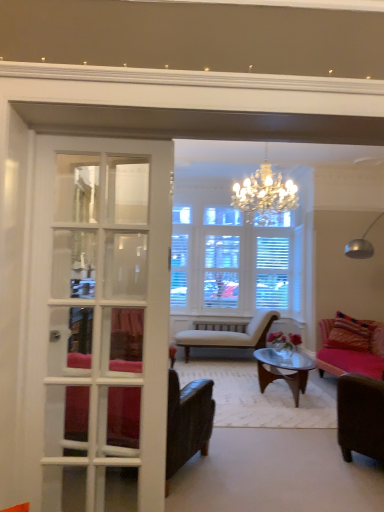
Question: Can you confirm if beige striped chaise lounge at center, placed as the 3th chair when sorted from front to back, is shorter than leather armchair at left, the 3th chair viewed from the back?

Choices:
 (A) no
 (B) yes

Answer: (B)

Question: Is beige striped chaise lounge at center, placed as the 3th chair when sorted from front to back, in contact with leather armchair at left, the 3th chair viewed from the back?

Choices:
 (A) no
 (B) yes

Answer: (A)

Question: Are beige striped chaise lounge at center, which ranks as the first chair in back-to-front order, and leather armchair at left, the first chair in the front-to-back sequence, far apart?

Choices:
 (A) no
 (B) yes

Answer: (B)

Question: From a real-world perspective, is beige striped chaise lounge at center, which ranks as the first chair in back-to-front order, positioned under leather armchair at left, the first chair in the front-to-back sequence, based on gravity?

Choices:
 (A) yes
 (B) no

Answer: (A)

Question: From the image's perspective, does beige striped chaise lounge at center, which ranks as the first chair in back-to-front order, appear higher than leather armchair at left, the first chair in the front-to-back sequence?

Choices:
 (A) no
 (B) yes

Answer: (A)

Question: Is white glass door at left wider or thinner than beige striped chaise lounge at center, which ranks as the first chair in back-to-front order?

Choices:
 (A) thin
 (B) wide

Answer: (A)

Question: Looking at the image, does white glass door at left seem bigger or smaller compared to beige striped chaise lounge at center, which ranks as the first chair in back-to-front order?

Choices:
 (A) big
 (B) small

Answer: (B)

Question: In the image, is white glass door at left positioned in front of or behind beige striped chaise lounge at center, which ranks as the first chair in back-to-front order?

Choices:
 (A) front
 (B) behind

Answer: (A)

Question: Is point (114, 240) positioned closer to the camera than point (235, 332)?

Choices:
 (A) closer
 (B) farther

Answer: (A)

Question: From the image's perspective, is beige striped chaise lounge at center, placed as the 3th chair when sorted from front to back, located above or below white glass door at left?

Choices:
 (A) below
 (B) above

Answer: (A)

Question: Is beige striped chaise lounge at center, which ranks as the first chair in back-to-front order, to the left or to the right of white glass door at left in the image?

Choices:
 (A) right
 (B) left

Answer: (A)

Question: Is point (254, 326) closer or farther from the camera than point (127, 162)?

Choices:
 (A) closer
 (B) farther

Answer: (B)

Question: From a real-world perspective, is beige striped chaise lounge at center, placed as the 3th chair when sorted from front to back, physically located above or below white glass door at left?

Choices:
 (A) below
 (B) above

Answer: (A)

Question: From the image's perspective, is brown leather chair at lower right, marked as the second chair in a front-to-back arrangement, located above or below beige striped chaise lounge at center, placed as the 3th chair when sorted from front to back?

Choices:
 (A) below
 (B) above

Answer: (B)

Question: From their relative heights in the image, would you say brown leather chair at lower right, which is counted as the second chair, starting from the back, is taller or shorter than beige striped chaise lounge at center, which ranks as the first chair in back-to-front order?

Choices:
 (A) tall
 (B) short

Answer: (B)